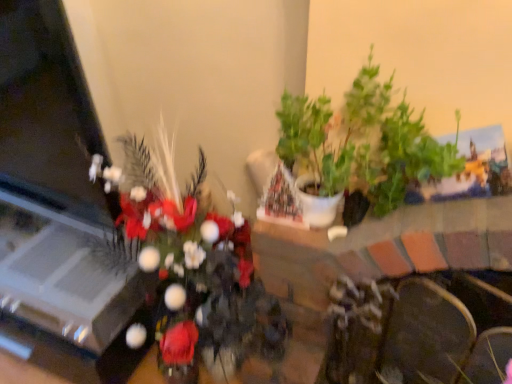
What do you see at coordinates (426, 331) in the screenshot?
I see `velvet dark brown armchair at lower right` at bounding box center [426, 331].

How much space does green leafy plant at center, the first houseplant when ordered from left to right, occupy horizontally?

green leafy plant at center, the first houseplant when ordered from left to right, is 16.84 inches wide.

Image resolution: width=512 pixels, height=384 pixels. I want to click on green matte plant at upper right, the 1th houseplant from the right, so point(362,142).

The image size is (512, 384). Find the location of `houseplant above the green leafy plant at center, the first houseplant when ordered from left to right (from the image's perspective)`. houseplant above the green leafy plant at center, the first houseplant when ordered from left to right (from the image's perspective) is located at coordinates (362, 142).

Who is shorter, green matte plant at upper right, the 1th houseplant from the right, or green leafy plant at center, the first houseplant when ordered from left to right?

Standing shorter between the two is green matte plant at upper right, the 1th houseplant from the right.

From a real-world perspective, is green matte plant at upper right, marked as the 2th houseplant in a left-to-right arrangement, located higher than green leafy plant at center, the first houseplant when ordered from left to right?

Yes.

Between green matte plant at upper right, the 1th houseplant from the right, and green leafy plant at center, positioned as the second houseplant in right-to-left order, which one is positioned behind?

green matte plant at upper right, the 1th houseplant from the right, is further away from the camera.

Which of these two, velvet dark brown armchair at lower right or green matte plant at upper right, marked as the 2th houseplant in a left-to-right arrangement, stands taller?

velvet dark brown armchair at lower right.

Looking at this image, does velvet dark brown armchair at lower right come behind green matte plant at upper right, marked as the 2th houseplant in a left-to-right arrangement?

Yes, it is.

Could you tell me if velvet dark brown armchair at lower right is facing green matte plant at upper right, the 1th houseplant from the right?

No, velvet dark brown armchair at lower right is not turned towards green matte plant at upper right, the 1th houseplant from the right.

Is green leafy plant at center, positioned as the second houseplant in right-to-left order, positioned behind green matte plant at upper right, marked as the 2th houseplant in a left-to-right arrangement?

No, the depth of green leafy plant at center, positioned as the second houseplant in right-to-left order, is less than that of green matte plant at upper right, marked as the 2th houseplant in a left-to-right arrangement.

Is green leafy plant at center, the first houseplant when ordered from left to right, facing towards green matte plant at upper right, the 1th houseplant from the right?

No, green leafy plant at center, the first houseplant when ordered from left to right, does not turn towards green matte plant at upper right, the 1th houseplant from the right.

Considering the sizes of objects green leafy plant at center, the first houseplant when ordered from left to right, and green matte plant at upper right, the 1th houseplant from the right, in the image provided, who is smaller, green leafy plant at center, the first houseplant when ordered from left to right, or green matte plant at upper right, the 1th houseplant from the right,?

With smaller size is green matte plant at upper right, the 1th houseplant from the right.

From the image's perspective, is green matte plant at upper right, marked as the 2th houseplant in a left-to-right arrangement, on velvet dark brown armchair at lower right?

Yes, from the image's perspective, green matte plant at upper right, marked as the 2th houseplant in a left-to-right arrangement, is over velvet dark brown armchair at lower right.

Considering the positions of point (322, 162) and point (465, 345), is point (322, 162) closer or farther from the camera than point (465, 345)?

Point (322, 162) is farther from the camera than point (465, 345).

From the picture: Is green matte plant at upper right, marked as the 2th houseplant in a left-to-right arrangement, bigger than velvet dark brown armchair at lower right?

Yes, green matte plant at upper right, marked as the 2th houseplant in a left-to-right arrangement, is bigger than velvet dark brown armchair at lower right.

Is green leafy plant at center, the first houseplant when ordered from left to right, wider than velvet dark brown armchair at lower right?

Yes.

Is green leafy plant at center, the first houseplant when ordered from left to right, in contact with velvet dark brown armchair at lower right?

green leafy plant at center, the first houseplant when ordered from left to right, and velvet dark brown armchair at lower right are clearly separated.

Could you tell me if green leafy plant at center, the first houseplant when ordered from left to right, is facing velvet dark brown armchair at lower right?

No.

Looking at this image, from the image's perspective, which one is positioned lower, green leafy plant at center, positioned as the second houseplant in right-to-left order, or velvet dark brown armchair at lower right?

From the image's view, velvet dark brown armchair at lower right is below.

Which object is further away from the camera, velvet dark brown armchair at lower right or green leafy plant at center, the first houseplant when ordered from left to right?

velvet dark brown armchair at lower right is more distant.

Could you measure the distance between velvet dark brown armchair at lower right and green leafy plant at center, positioned as the second houseplant in right-to-left order?

19.18 inches.

Where is `the 2nd houseplant in front of the velvet dark brown armchair at lower right`? the 2nd houseplant in front of the velvet dark brown armchair at lower right is located at coordinates (189, 264).

Looking at this image, from a real-world perspective, is velvet dark brown armchair at lower right positioned under green leafy plant at center, positioned as the second houseplant in right-to-left order, based on gravity?

Yes, from a real-world perspective, velvet dark brown armchair at lower right is under green leafy plant at center, positioned as the second houseplant in right-to-left order.

You are a GUI agent. You are given a task and a screenshot of the screen. Output one action in this format:
    pyautogui.click(x=<x>, y=<y>)
    Task: Click on the houseplant on the left of green matte plant at upper right, the 1th houseplant from the right
    
    Given the screenshot: What is the action you would take?
    pyautogui.click(x=189, y=264)

This screenshot has height=384, width=512. What are the coordinates of `armchair behind the green matte plant at upper right, marked as the 2th houseplant in a left-to-right arrangement` in the screenshot? It's located at point(426,331).

Consider the image. Estimate the real-world distances between objects in this image. Which object is closer to velvet dark brown armchair at lower right, green matte plant at upper right, marked as the 2th houseplant in a left-to-right arrangement, or green leafy plant at center, positioned as the second houseplant in right-to-left order?

green matte plant at upper right, marked as the 2th houseplant in a left-to-right arrangement.

Based on their spatial positions, is green matte plant at upper right, the 1th houseplant from the right, or velvet dark brown armchair at lower right further from green leafy plant at center, the first houseplant when ordered from left to right?

velvet dark brown armchair at lower right is further to green leafy plant at center, the first houseplant when ordered from left to right.

When comparing their distances from green leafy plant at center, positioned as the second houseplant in right-to-left order, does velvet dark brown armchair at lower right or green matte plant at upper right, the 1th houseplant from the right, seem closer?

green matte plant at upper right, the 1th houseplant from the right, is positioned closer to the anchor green leafy plant at center, positioned as the second houseplant in right-to-left order.

Estimate the real-world distances between objects in this image. Which object is closer to velvet dark brown armchair at lower right, green leafy plant at center, positioned as the second houseplant in right-to-left order, or green matte plant at upper right, the 1th houseplant from the right?

green matte plant at upper right, the 1th houseplant from the right.

Based on their spatial positions, is velvet dark brown armchair at lower right or green leafy plant at center, positioned as the second houseplant in right-to-left order, closer to green matte plant at upper right, marked as the 2th houseplant in a left-to-right arrangement?

The object closer to green matte plant at upper right, marked as the 2th houseplant in a left-to-right arrangement, is velvet dark brown armchair at lower right.

Which object lies further to the anchor point green matte plant at upper right, marked as the 2th houseplant in a left-to-right arrangement, green leafy plant at center, positioned as the second houseplant in right-to-left order, or velvet dark brown armchair at lower right?

green leafy plant at center, positioned as the second houseplant in right-to-left order.

The image size is (512, 384). I want to click on houseplant between green leafy plant at center, positioned as the second houseplant in right-to-left order, and velvet dark brown armchair at lower right, so click(x=362, y=142).